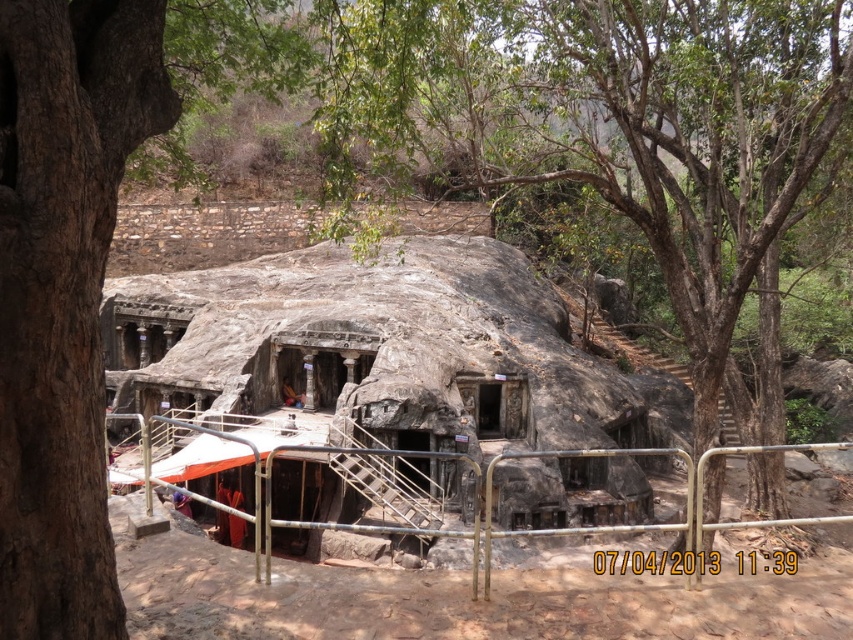
Is point (695, 209) positioned before point (90, 572)?

No, (695, 209) is behind (90, 572).

This screenshot has width=853, height=640. What do you see at coordinates (611, 120) in the screenshot? I see `green leafy tree at center` at bounding box center [611, 120].

I want to click on green leafy tree at center, so click(x=611, y=120).

Locate an element on the screen. The height and width of the screenshot is (640, 853). green leafy tree at center is located at coordinates coord(611,120).

Does green leafy tree at center appear over natural stone cave at center?

Correct, green leafy tree at center is located above natural stone cave at center.

Is the position of green leafy tree at center more distant than that of natural stone cave at center?

That is False.

Identify the location of green leafy tree at center. (611, 120).

At what (x,y) coordinates should I click in order to perform the action: click on natural stone cave at center. Please return your answer as a coordinate pair (x, y). Looking at the image, I should click on (381, 348).

Describe the element at coordinates (381, 348) in the screenshot. The width and height of the screenshot is (853, 640). I see `natural stone cave at center` at that location.

Where is `natural stone cave at center`? The image size is (853, 640). natural stone cave at center is located at coordinates (381, 348).